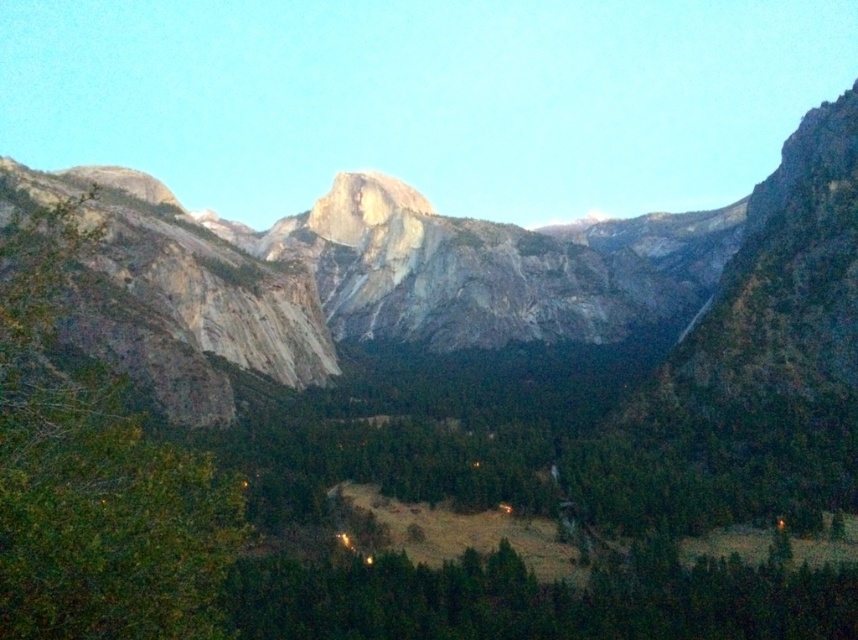
You are an environmental scientist assessing the biodiversity of this mountain area. You observe the green leafy tree at left and the green matte tree at lower center. Which tree has a narrower width, and how might this affect its role in the ecosystem?

The green leafy tree at left has a lesser width compared to the green matte tree at lower center. A narrower tree might have a smaller canopy, potentially providing less shade and habitat for smaller organisms compared to the wider tree.

You are standing at the center of the image and want to find the green leafy tree at left. In which direction should you look to see it?

The green leafy tree at left is located at the left side of the image, so you should look to your left to see it.